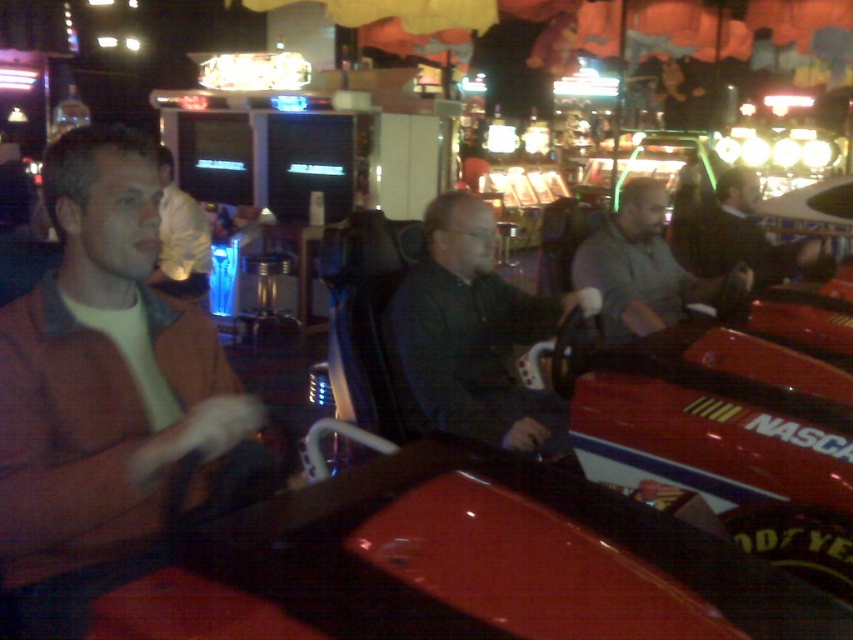
Based on the photo, does matte brown jacket at left appear on the left side of white shirt at center?

No, matte brown jacket at left is not to the left of white shirt at center.

Between matte brown jacket at left and white shirt at center, which one appears on the left side from the viewer's perspective?

white shirt at center

In order to click on matte brown jacket at left in this screenshot , I will do `click(105, 392)`.

Is dark gray shirt at center bigger than dark gray sweater at center?

Indeed, dark gray shirt at center has a larger size compared to dark gray sweater at center.

Can you confirm if dark gray shirt at center is wider than dark gray sweater at center?

Yes, dark gray shirt at center is wider than dark gray sweater at center.

Who is more distant from viewer, (509, 310) or (734, 209)?

The point (734, 209) is behind.

At what (x,y) coordinates should I click in order to perform the action: click on dark gray shirt at center. Please return your answer as a coordinate pair (x, y). The width and height of the screenshot is (853, 640). Looking at the image, I should click on coord(474,336).

The height and width of the screenshot is (640, 853). What do you see at coordinates (474, 336) in the screenshot?
I see `dark gray shirt at center` at bounding box center [474, 336].

Who is higher up, dark gray shirt at center or white shirt at center?

white shirt at center is higher up.

In order to click on dark gray shirt at center in this screenshot , I will do `click(474, 336)`.